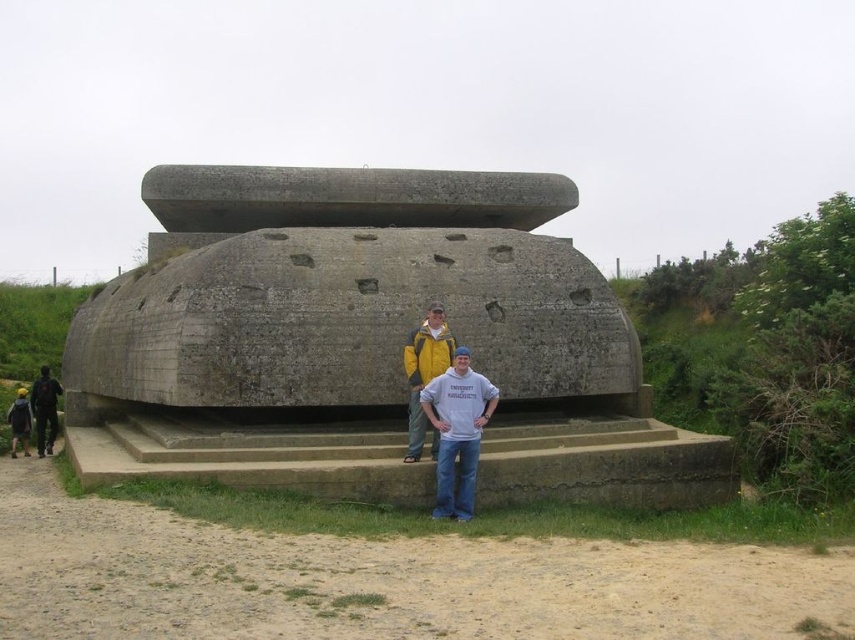
Question: Considering the relative positions of concrete bunker at center and dark blue denim jacket at lower left in the image provided, where is concrete bunker at center located with respect to dark blue denim jacket at lower left?

Choices:
 (A) right
 (B) left

Answer: (A)

Question: Among these points, which one is farthest from the camera?

Choices:
 (A) click(x=460, y=435)
 (B) click(x=432, y=307)
 (C) click(x=93, y=449)

Answer: (C)

Question: Which of the following is the closest to the observer?

Choices:
 (A) (43, 376)
 (B) (408, 436)

Answer: (B)

Question: Which of the following is the closest to the observer?

Choices:
 (A) (410, 422)
 (B) (511, 234)

Answer: (A)

Question: Can you confirm if matte gray concrete statue at center is positioned to the left of dark blue denim jacket at lower left?

Choices:
 (A) no
 (B) yes

Answer: (A)

Question: From the image, what is the correct spatial relationship of matte gray concrete statue at center in relation to dark blue denim jacket at lower left?

Choices:
 (A) right
 (B) left

Answer: (A)